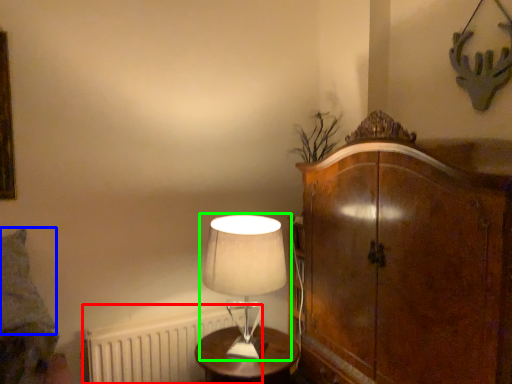
Question: Which object is the farthest from radiator (highlighted by a red box)? Choose among these: pillow (highlighted by a blue box) or lamp (highlighted by a green box).

Choices:
 (A) pillow
 (B) lamp

Answer: (B)